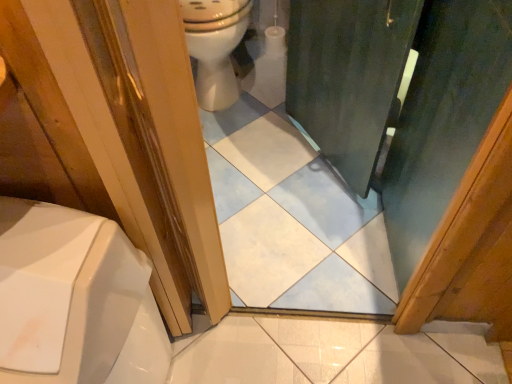
In order to face white glossy toilet at upper center, should I rotate leftwards or rightwards?

You should rotate left by 5.267 degrees.

The image size is (512, 384). What do you see at coordinates (215, 47) in the screenshot?
I see `white glossy toilet at upper center` at bounding box center [215, 47].

In the scene shown: What is the approximate width of white glossy toilet at upper center?

26.75 inches.

This screenshot has height=384, width=512. I want to click on white glossy toilet at upper center, so click(215, 47).

What is the approximate height of green matte screen door at center?

The height of green matte screen door at center is 35.57 inches.

Describe the element at coordinates (443, 118) in the screenshot. I see `green matte screen door at center` at that location.

The height and width of the screenshot is (384, 512). In order to click on green matte screen door at center in this screenshot , I will do `click(443, 118)`.

What are the coordinates of `white glossy toilet at upper center` in the screenshot? It's located at (215, 47).

Considering the positions of objects green matte screen door at center and white glossy toilet at upper center in the image provided, who is more to the right, green matte screen door at center or white glossy toilet at upper center?

green matte screen door at center.

Which object is further away from the camera, green matte screen door at center or white glossy toilet at upper center?

white glossy toilet at upper center is further from the camera.

Which is behind, point (469, 83) or point (192, 23)?

The point (192, 23) is more distant.

From the image's perspective, is green matte screen door at center located beneath white glossy toilet at upper center?

Correct, green matte screen door at center appears lower than white glossy toilet at upper center in the image.

Based on the photo, from a real-world perspective, is green matte screen door at center below white glossy toilet at upper center?

No.

Is green matte screen door at center wider than white glossy toilet at upper center?

No, green matte screen door at center is not wider than white glossy toilet at upper center.

Is green matte screen door at center taller than white glossy toilet at upper center?

Indeed, green matte screen door at center has a greater height compared to white glossy toilet at upper center.

Can you confirm if green matte screen door at center is smaller than white glossy toilet at upper center?

Actually, green matte screen door at center might be larger than white glossy toilet at upper center.

Is green matte screen door at center not inside white glossy toilet at upper center?

green matte screen door at center is positioned outside white glossy toilet at upper center.

In the scene shown: Is green matte screen door at center positioned far away from white glossy toilet at upper center?

No, there isn't a large distance between green matte screen door at center and white glossy toilet at upper center.

Is green matte screen door at center facing away from white glossy toilet at upper center?

No, green matte screen door at center's orientation is not away from white glossy toilet at upper center.

What's the angular difference between green matte screen door at center and white glossy toilet at upper center's facing directions?

The angle between the facing direction of green matte screen door at center and the facing direction of white glossy toilet at upper center is 88.5 degrees.

Measure the distance from green matte screen door at center to white glossy toilet at upper center.

32.52 inches.

Locate an element on the screen. The image size is (512, 384). screen door that appears on the right of white glossy toilet at upper center is located at coordinates (443, 118).

Between white glossy toilet at upper center and green matte screen door at center, which one appears on the left side from the viewer's perspective?

white glossy toilet at upper center.

Is white glossy toilet at upper center further to camera compared to green matte screen door at center?

Yes, the depth of white glossy toilet at upper center is greater than that of green matte screen door at center.

Considering the positions of point (211, 79) and point (409, 268), is point (211, 79) closer or farther from the camera than point (409, 268)?

Point (211, 79) appears to be farther away from the viewer than point (409, 268).

From the image's perspective, relative to green matte screen door at center, is white glossy toilet at upper center above or below?

Based on their image positions, white glossy toilet at upper center is located above green matte screen door at center.

Looking at this image, from a real-world perspective, which is physically above, white glossy toilet at upper center or green matte screen door at center?

green matte screen door at center, from a real-world perspective.

In terms of width, does white glossy toilet at upper center look wider or thinner when compared to green matte screen door at center?

Considering their sizes, white glossy toilet at upper center looks broader than green matte screen door at center.

Considering the relative sizes of white glossy toilet at upper center and green matte screen door at center in the image provided, is white glossy toilet at upper center taller than green matte screen door at center?

No.

Is white glossy toilet at upper center bigger than green matte screen door at center?

Incorrect, white glossy toilet at upper center is not larger than green matte screen door at center.

Is white glossy toilet at upper center inside or outside of green matte screen door at center?

white glossy toilet at upper center is spatially situated outside green matte screen door at center.

Are white glossy toilet at upper center and green matte screen door at center beside each other?

white glossy toilet at upper center and green matte screen door at center are clearly separated.

Is white glossy toilet at upper center oriented towards green matte screen door at center?

No, white glossy toilet at upper center is not facing towards green matte screen door at center.

How far apart are white glossy toilet at upper center and green matte screen door at center?

32.52 inches.

Where is `toilet below the green matte screen door at center (from a real-world perspective)`? The width and height of the screenshot is (512, 384). toilet below the green matte screen door at center (from a real-world perspective) is located at coordinates (215, 47).

Identify the location of screen door on the right of the white glossy toilet at upper center. (443, 118).

The width and height of the screenshot is (512, 384). Identify the location of toilet located behind the green matte screen door at center. (215, 47).